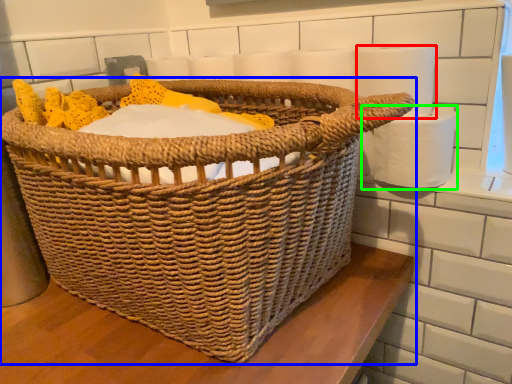
Question: Which object is the farthest from toilet paper (highlighted by a red box)? Choose among these: picnic basket (highlighted by a blue box) or toilet paper (highlighted by a green box).

Choices:
 (A) picnic basket
 (B) toilet paper

Answer: (A)